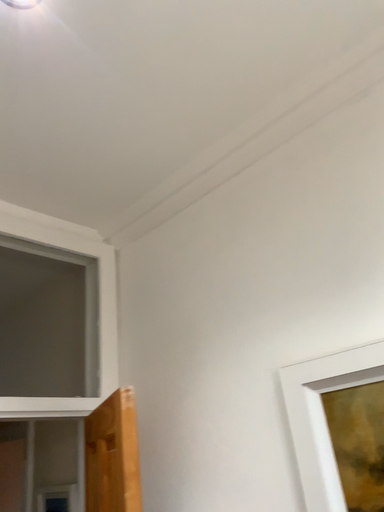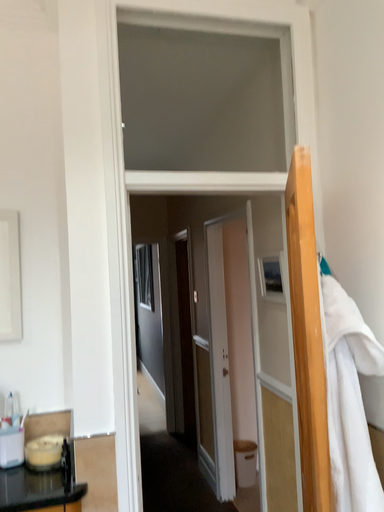
Question: How did the camera likely rotate when shooting the video?

Choices:
 (A) rotated left
 (B) rotated right

Answer: (A)